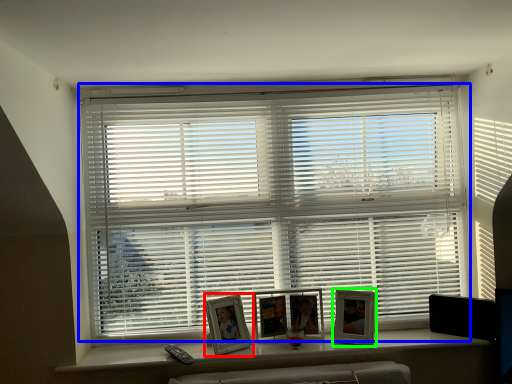
Question: Which is farther away from picture frame (highlighted by a red box)? window blind (highlighted by a blue box) or picture frame (highlighted by a green box)?

Choices:
 (A) window blind
 (B) picture frame

Answer: (A)